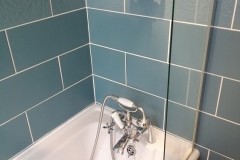
The image size is (240, 160). What are the coordinates of `faucet hardware` in the screenshot? It's located at click(x=128, y=122).